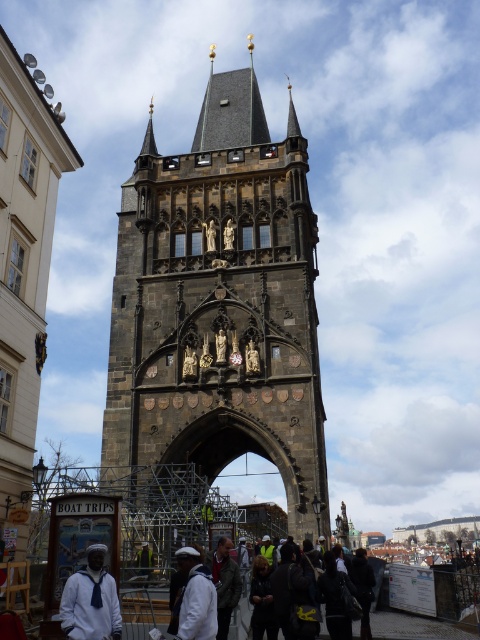
Can you confirm if white matte jacket at lower center is positioned to the right of dark gray jacket at center?

No, white matte jacket at lower center is not to the right of dark gray jacket at center.

How much distance is there between white matte jacket at lower center and dark gray jacket at center?

11.55 feet

This screenshot has height=640, width=480. In order to click on white matte jacket at lower center in this screenshot , I will do pos(195,596).

Image resolution: width=480 pixels, height=640 pixels. In order to click on white matte jacket at lower center in this screenshot , I will do `click(195, 596)`.

Is dark gray stone tower at center wider than dark gray stone spire at center top?

Indeed, dark gray stone tower at center has a greater width compared to dark gray stone spire at center top.

Who is more forward, (x=158, y=372) or (x=214, y=112)?

Point (x=158, y=372) is more forward.

Is point (235, 317) closer to camera compared to point (253, 120)?

Yes, point (235, 317) is in front of point (253, 120).

Where is `dark gray stone tower at center`? The height and width of the screenshot is (640, 480). dark gray stone tower at center is located at coordinates (219, 304).

Identify the location of dark gray stone spire at center top. The image size is (480, 640). (230, 109).

Which is more to the left, dark gray stone spire at center top or white matte jacket at lower center?

dark gray stone spire at center top

Is point (240, 113) positioned in front of point (204, 580)?

No, (240, 113) is further to viewer.

Locate an element on the screen. dark gray stone spire at center top is located at coordinates (230, 109).